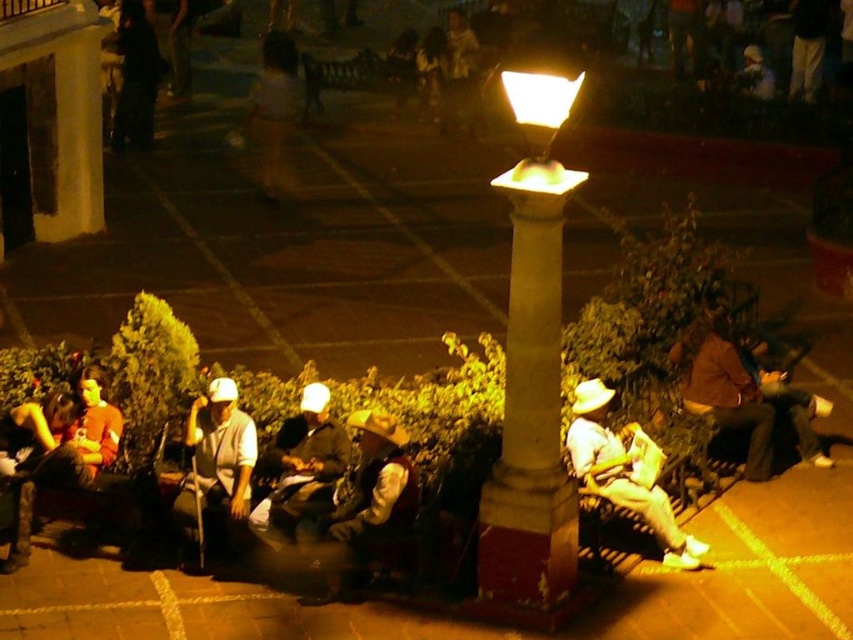
At what (x,y) coordinates should I click in order to perform the action: click on camouflage fabric construction worker at center. Please return your answer as a coordinate pair (x, y). The width and height of the screenshot is (853, 640). Looking at the image, I should click on (364, 500).

Consider the image. Is camouflage fabric construction worker at center smaller than white matte hat at center?

Correct, camouflage fabric construction worker at center occupies less space than white matte hat at center.

Which is behind, point (331, 554) or point (654, 492)?

Point (654, 492)

I want to click on camouflage fabric construction worker at center, so click(364, 500).

Between white fabric shirt at center and light brown leather jacket at center, which one appears on the left side from the viewer's perspective?

Positioned to the left is white fabric shirt at center.

Consider the image. Who is more distant from viewer, (225, 442) or (258, 500)?

The point (258, 500) is more distant.

This screenshot has width=853, height=640. In order to click on white fabric shirt at center in this screenshot , I will do `click(215, 461)`.

Does white marble column at center come behind white fabric shirt at center?

No, white marble column at center is in front of white fabric shirt at center.

Who is more forward, (503, 444) or (229, 468)?

Point (503, 444) is more forward.

Is point (558, 564) in front of point (196, 422)?

Yes, point (558, 564) is in front of point (196, 422).

Find the location of a particular element. This screenshot has height=640, width=853. white marble column at center is located at coordinates (532, 369).